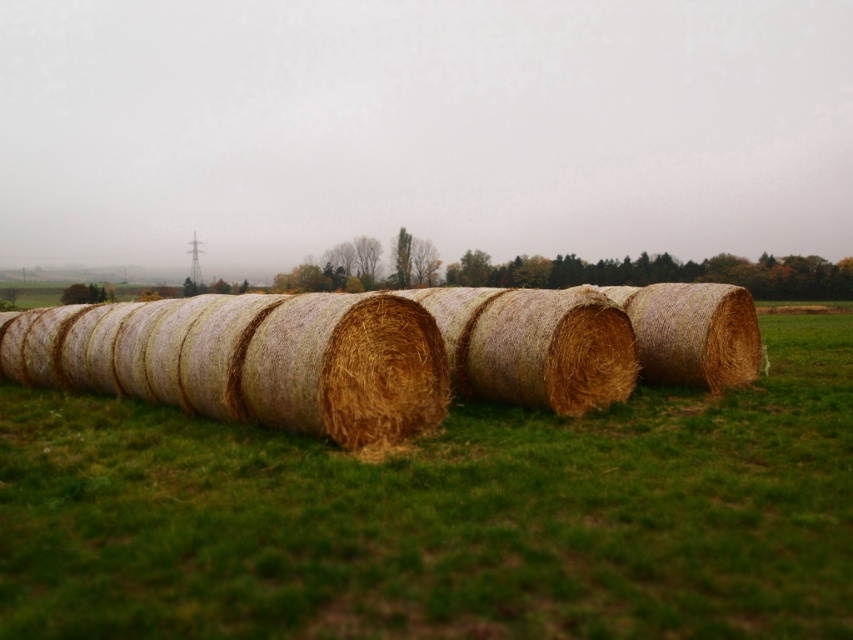
Between green grass at center and golden straw bales at center, which one appears on the right side from the viewer's perspective?

green grass at center

The height and width of the screenshot is (640, 853). Identify the location of green grass at center. (444, 516).